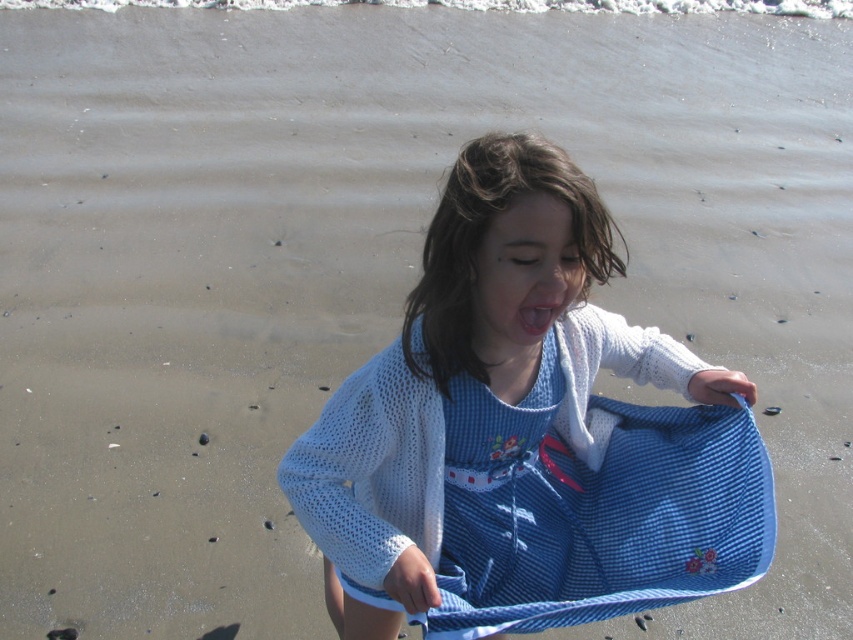
You are a photographer trying to capture the girl without any obstructions. Since the white mesh sweater at center and the pink glossy lips at center are both in the frame, which one should you focus on to ensure the other isn t blocked?

You should focus on the white mesh sweater at center because it is in front of the pink glossy lips at center, so focusing on it will keep the sweater in the foreground while the lips might be slightly out of focus but not blocked.